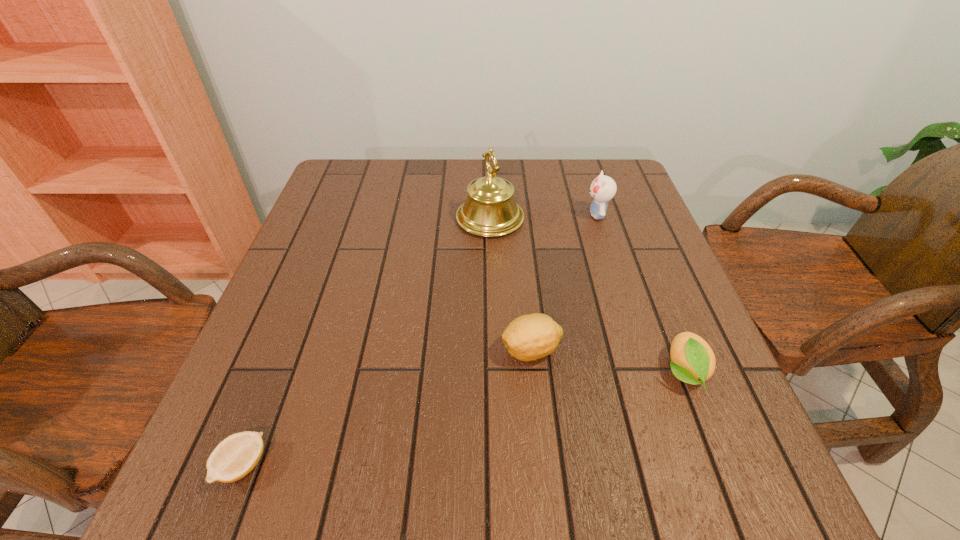
Where is `free spot located 0.260m at the stem end of the second lemon from left to right`? The image size is (960, 540). free spot located 0.260m at the stem end of the second lemon from left to right is located at coordinates (364, 350).

Locate an element on the screen. This screenshot has height=540, width=960. vacant space located at the stem end of the second lemon from left to right is located at coordinates (370, 350).

You are a GUI agent. You are given a task and a screenshot of the screen. Output one action in this format:
    pyautogui.click(x=<x>, y=<y>)
    Task: Click on the vacant space located at the stem end of the second lemon from left to right
    
    Given the screenshot: What is the action you would take?
    pyautogui.click(x=438, y=350)

Image resolution: width=960 pixels, height=540 pixels. I want to click on free space located with leaves positioned above the rightmost lemon, so click(x=712, y=445).

This screenshot has height=540, width=960. Find the location of `free point located 0.220m on the right of the shortest object`. free point located 0.220m on the right of the shortest object is located at coordinates (409, 466).

Find the location of a particular element. object that is at the far edge is located at coordinates (490, 210).

This screenshot has height=540, width=960. Find the location of `object that is at the near edge`. object that is at the near edge is located at coordinates (236, 456).

Where is `object positioned at the left edge`? object positioned at the left edge is located at coordinates (236, 456).

The height and width of the screenshot is (540, 960). I want to click on kitten situated at the right edge, so click(x=603, y=188).

Where is `lemon present at the right edge`? The image size is (960, 540). lemon present at the right edge is located at coordinates [x=692, y=360].